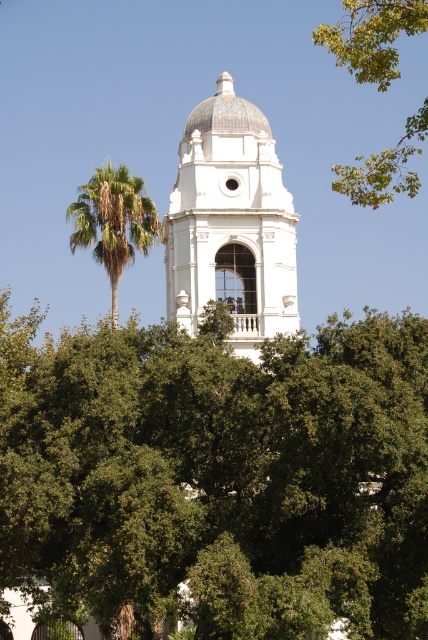
Question: Observing the image, what is the correct spatial positioning of green leafy tree at upper right in reference to multicolored mosaic dome at center?

Choices:
 (A) left
 (B) right

Answer: (B)

Question: Which object is farther from the camera taking this photo?

Choices:
 (A) multicolored mosaic dome at center
 (B) green leafy tree at upper right
 (C) green leafy palm at upper left

Answer: (A)

Question: Which point is farther to the camera?

Choices:
 (A) white glossy dome at center
 (B) green leafy tree at center
 (C) multicolored mosaic dome at center
 (D) green leafy tree at upper right

Answer: (C)

Question: From the image, what is the correct spatial relationship of green leafy tree at center in relation to green leafy palm at upper left?

Choices:
 (A) right
 (B) left

Answer: (A)

Question: Can you confirm if green leafy tree at center is positioned below green leafy palm at upper left?

Choices:
 (A) no
 (B) yes

Answer: (B)

Question: Which point is closer to the camera?

Choices:
 (A) green leafy palm at upper left
 (B) green leafy tree at upper right
 (C) green leafy tree at center
 (D) white glossy dome at center

Answer: (B)